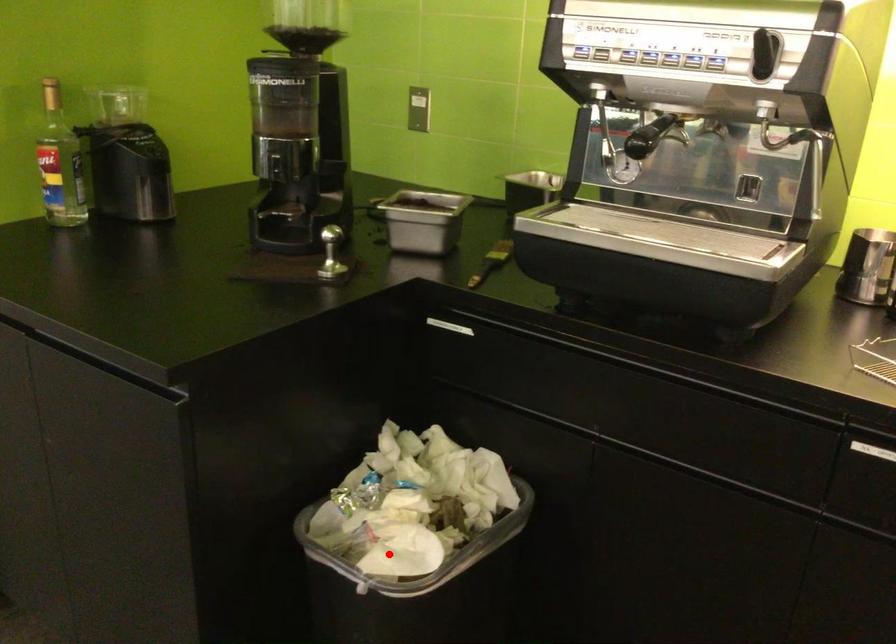
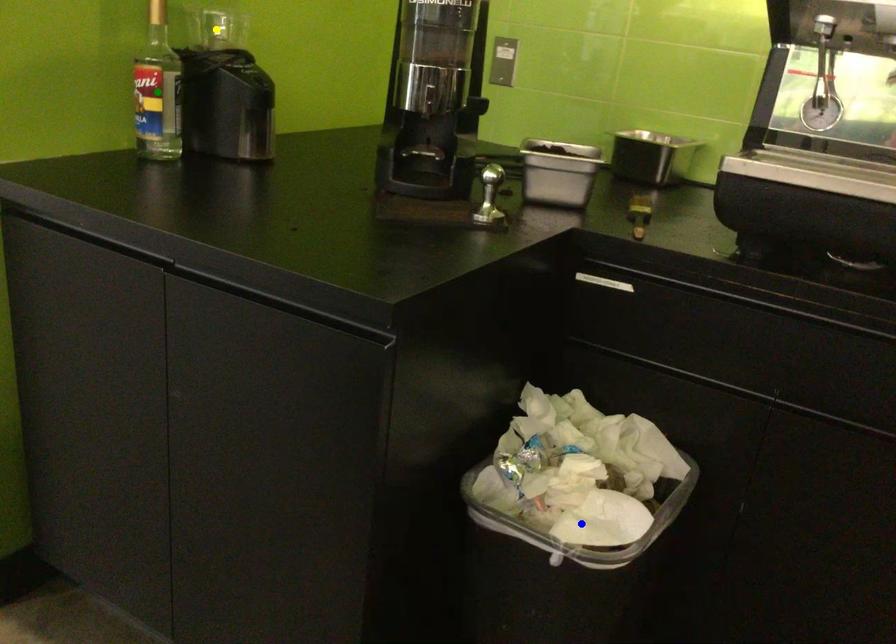
Question: I am providing you with two images of the same scene from different viewpoints. A red point is marked on the first image. You are given multiple points on the second image. Which point in image 2 represents the same 3d spot as the red point in image 1?

Choices:
 (A) blue point
 (B) green point
 (C) yellow point

Answer: (A)